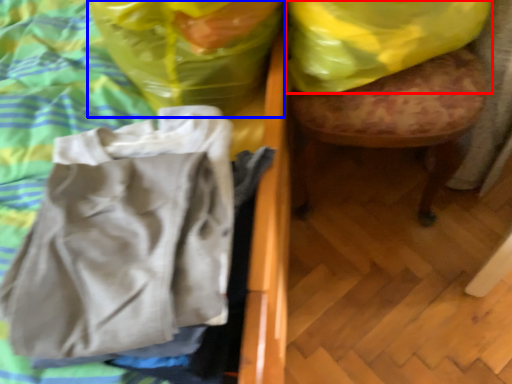
Question: Which point is closer to the camera, plastic bag (highlighted by a red box) or plastic bag (highlighted by a blue box)?

Choices:
 (A) plastic bag
 (B) plastic bag

Answer: (B)